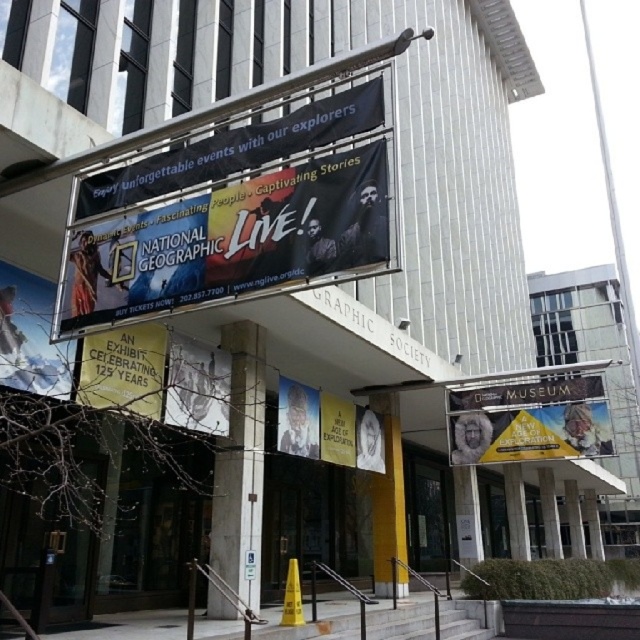
Question: Which of these objects is positioned closest to the matte black banner at upper center?

Choices:
 (A) matte plastic poster at center
 (B) white paper sign at center
 (C) yellow fabric banner at center

Answer: (B)

Question: Which object is farther from the camera taking this photo?

Choices:
 (A) yellow fabric banner at center
 (B) matte black banner at upper center

Answer: (A)

Question: Can you confirm if matte black banner at upper center is positioned to the left of matte white snowboard at left?

Choices:
 (A) no
 (B) yes

Answer: (A)

Question: Which object appears farthest from the camera in this image?

Choices:
 (A) black fabric banner at upper center
 (B) matte plastic poster at center
 (C) matte black banner at upper center
 (D) white paper sign at center

Answer: (B)

Question: Can you confirm if matte plastic poster at center is bigger than white paper billboard at center?

Choices:
 (A) yes
 (B) no

Answer: (B)

Question: Is yellow paper at center behind white paper billboard at center?

Choices:
 (A) yes
 (B) no

Answer: (B)